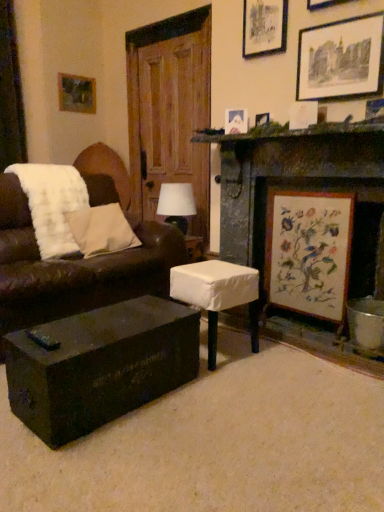
Find the location of a particular element. Image resolution: width=384 pixels, height=512 pixels. vacant space situated above white fabric-covered stool at center (from a real-world perspective) is located at coordinates (215, 267).